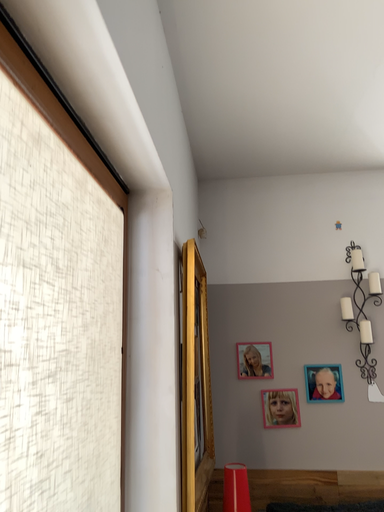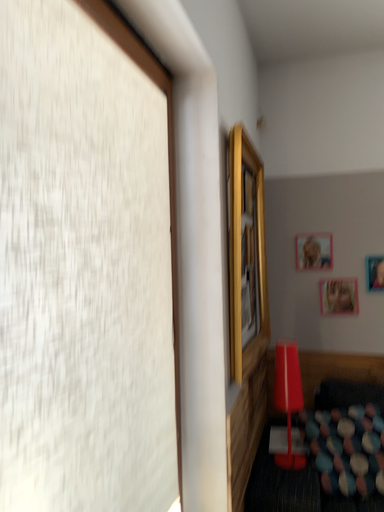
Question: Which way did the camera rotate in the video?

Choices:
 (A) rotated downward
 (B) rotated upward

Answer: (A)